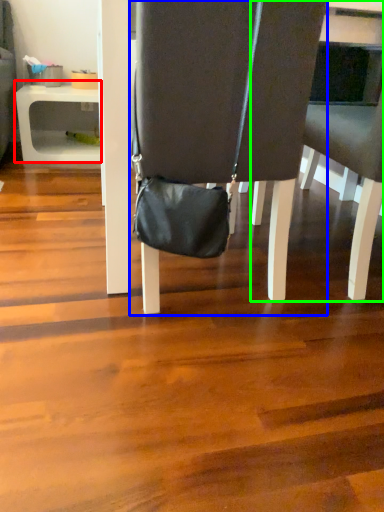
Question: Which object is positioned closest to table (highlighted by a red box)? Select from chair (highlighted by a blue box) and chair (highlighted by a green box).

Choices:
 (A) chair
 (B) chair

Answer: (A)